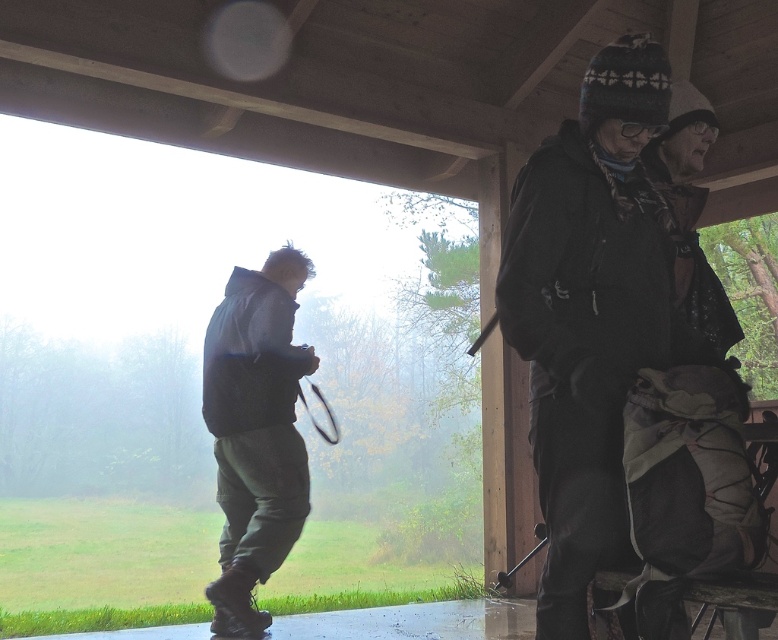
You are organizing a winter camping trip and need to pack items from the pavilion. The dark gray knit hat at upper right and the black rubber tennis racket at lower left are both on the table. If you have a backpack with a width limit of 30 cm, which item can you fit without exceeding the width limit?

The black rubber tennis racket at lower left can fit in the backpack since its width is smaller than the dark gray knit hat at upper right, which exceeds the 30 cm limit.

You are standing inside the wooden pavilion and notice two items. One is the dark gray knit hat at upper right and the other is the dark green pants at left. Which item is located higher up in the image?

The dark gray knit hat at upper right is positioned over the dark green pants at left, so it is higher up in the image.

You are standing inside the wooden pavilion and want to take a photo of the person wearing the dark green pants at left without including the dark gray knit hat at upper right in the frame. Which direction should you move your camera to avoid capturing the hat?

Move your camera to the left to avoid capturing the dark gray knit hat at upper right, as it is positioned to the right of the dark green pants at left.